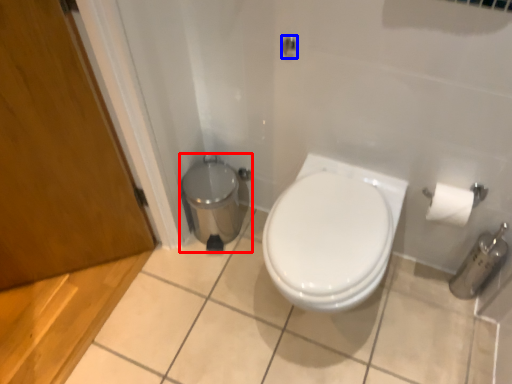
Question: Which of the following is the farthest to the observer, porcelain (highlighted by a red box) or shower (highlighted by a blue box)?

Choices:
 (A) porcelain
 (B) shower

Answer: (A)